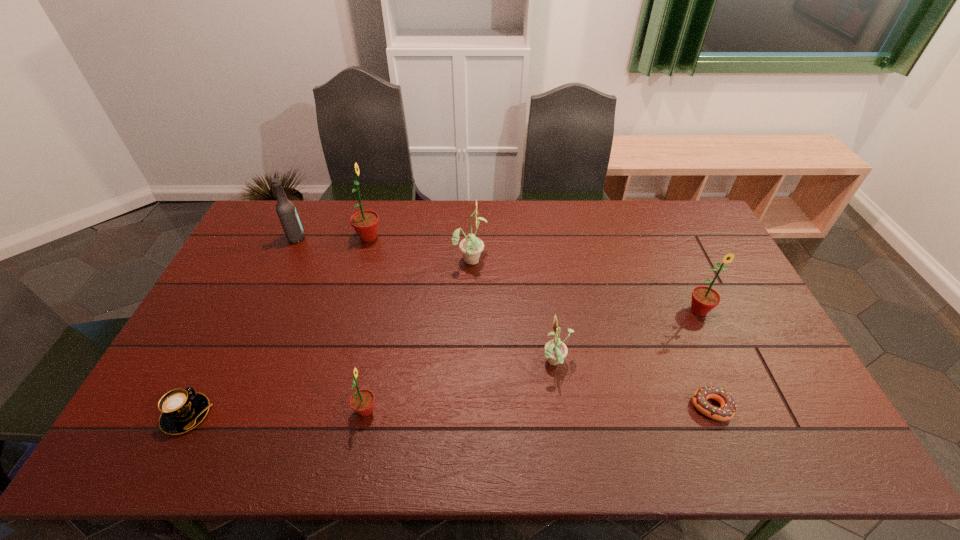
Identify the location of green sunflower that is the second closest to the sixth object from left to right. The height and width of the screenshot is (540, 960). (362, 401).

Where is `the closest green sunflower relative to the fifth nearest object`? This screenshot has width=960, height=540. the closest green sunflower relative to the fifth nearest object is located at coordinates (362, 401).

Locate an element on the screen. vacant space that satisfies the following two spatial constraints: 1. on the front-facing side of the nearer yellow sunflower; 2. on the left side of the shortest object is located at coordinates (562, 407).